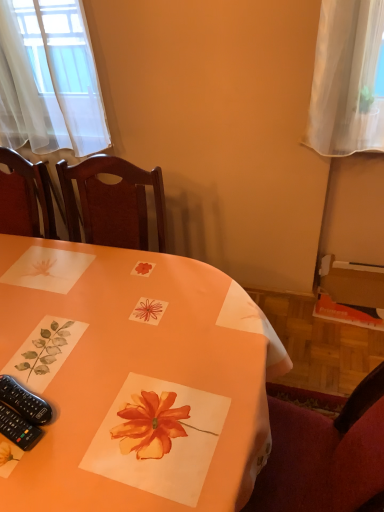
Question: Would you say black plastic remote control at lower left, the first remote control positioned from the bottom, is part of black plastic remote control at lower left, positioned as the 2th remote control in bottom-to-top order,'s contents?

Choices:
 (A) yes
 (B) no

Answer: (B)

Question: From the image's perspective, does black plastic remote control at lower left, which is counted as the first remote control, starting from the top, appear lower than black plastic remote control at lower left, positioned as the second remote control in top-to-bottom order?

Choices:
 (A) no
 (B) yes

Answer: (A)

Question: From a real-world perspective, is black plastic remote control at lower left, which is counted as the first remote control, starting from the top, physically below black plastic remote control at lower left, the first remote control positioned from the bottom?

Choices:
 (A) no
 (B) yes

Answer: (A)

Question: Considering the relative positions of black plastic remote control at lower left, positioned as the 2th remote control in bottom-to-top order, and black plastic remote control at lower left, the first remote control positioned from the bottom, in the image provided, is black plastic remote control at lower left, positioned as the 2th remote control in bottom-to-top order, to the right of black plastic remote control at lower left, the first remote control positioned from the bottom, from the viewer's perspective?

Choices:
 (A) no
 (B) yes

Answer: (B)

Question: From a real-world perspective, is black plastic remote control at lower left, which is counted as the first remote control, starting from the top, located higher than black plastic remote control at lower left, positioned as the second remote control in top-to-bottom order?

Choices:
 (A) yes
 (B) no

Answer: (A)

Question: Is orange paper placemat at center inside or outside of black plastic remote control at lower left, the first remote control positioned from the bottom?

Choices:
 (A) inside
 (B) outside

Answer: (B)

Question: From a real-world perspective, is orange paper placemat at center above or below black plastic remote control at lower left, positioned as the second remote control in top-to-bottom order?

Choices:
 (A) above
 (B) below

Answer: (B)

Question: Based on their positions, is orange paper placemat at center located to the left or right of black plastic remote control at lower left, positioned as the second remote control in top-to-bottom order?

Choices:
 (A) right
 (B) left

Answer: (B)

Question: Is point (190, 467) positioned closer to the camera than point (9, 432)?

Choices:
 (A) closer
 (B) farther

Answer: (A)

Question: In the image, is black plastic remote control at lower left, which is counted as the first remote control, starting from the top, on the left side or the right side of black plastic remote control at lower left, positioned as the second remote control in top-to-bottom order?

Choices:
 (A) right
 (B) left

Answer: (A)

Question: From a real-world perspective, is black plastic remote control at lower left, which is counted as the first remote control, starting from the top, above or below black plastic remote control at lower left, positioned as the second remote control in top-to-bottom order?

Choices:
 (A) below
 (B) above

Answer: (B)

Question: Would you say black plastic remote control at lower left, positioned as the 2th remote control in bottom-to-top order, is inside or outside black plastic remote control at lower left, positioned as the second remote control in top-to-bottom order?

Choices:
 (A) inside
 (B) outside

Answer: (B)

Question: In terms of size, does black plastic remote control at lower left, positioned as the 2th remote control in bottom-to-top order, appear bigger or smaller than black plastic remote control at lower left, the first remote control positioned from the bottom?

Choices:
 (A) big
 (B) small

Answer: (A)

Question: Looking at the image, does black plastic remote control at lower left, positioned as the second remote control in top-to-bottom order, seem bigger or smaller compared to orange paper placemat at center?

Choices:
 (A) small
 (B) big

Answer: (A)

Question: In terms of width, does black plastic remote control at lower left, positioned as the second remote control in top-to-bottom order, look wider or thinner when compared to orange paper placemat at center?

Choices:
 (A) thin
 (B) wide

Answer: (A)